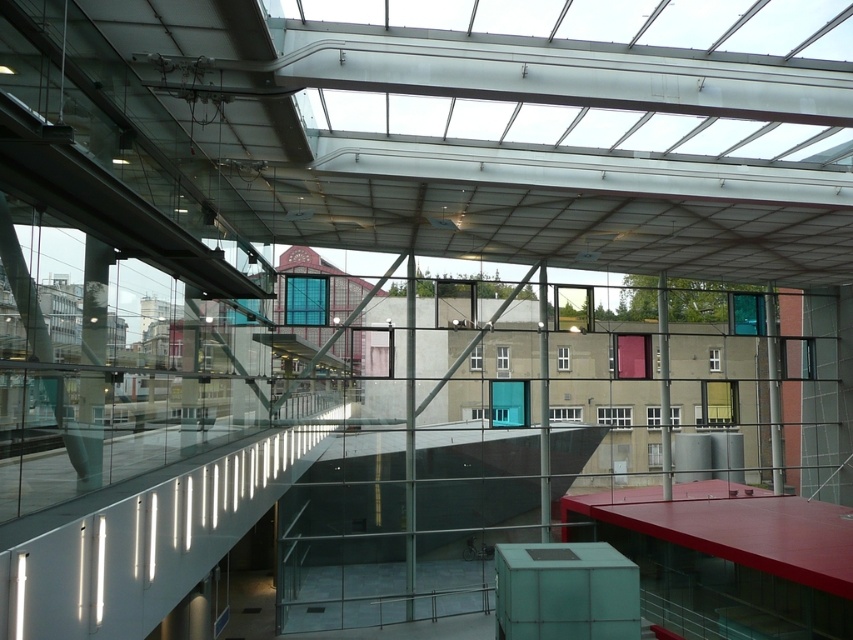
Question: Which point appears closest to the camera in this image?

Choices:
 (A) (108, 256)
 (B) (663, 435)

Answer: (A)

Question: Is matte glass pillar at left bigger than matte glass pillar at center?

Choices:
 (A) yes
 (B) no

Answer: (A)

Question: Does matte glass pillar at left have a greater width compared to matte glass pillar at center?

Choices:
 (A) yes
 (B) no

Answer: (B)

Question: From the image, what is the correct spatial relationship of matte glass pillar at left in relation to matte glass pillar at center?

Choices:
 (A) above
 (B) below

Answer: (A)